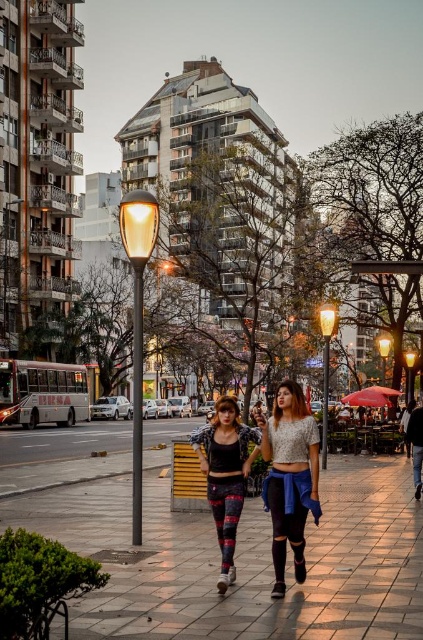
Question: Can you confirm if matte lace top at center is positioned above matte yellow glass at center?

Choices:
 (A) yes
 (B) no

Answer: (B)

Question: Is polished stone pavement at center in front of patterned leggings at center?

Choices:
 (A) yes
 (B) no

Answer: (A)

Question: Which point is farther to the camera?

Choices:
 (A) patterned leggings at center
 (B) metallic streetlight at center

Answer: (B)

Question: Can you confirm if patterned leggings at center is positioned to the left of matte glass streetlight at center?

Choices:
 (A) no
 (B) yes

Answer: (B)

Question: Which of the following is the closest to the observer?

Choices:
 (A) polished stone pavement at center
 (B) matte lace top at center
 (C) matte yellow streetlight at center
 (D) patterned leggings at center

Answer: (A)

Question: Among these objects, which one is nearest to the camera?

Choices:
 (A) polished stone pavement at center
 (B) matte glass streetlight at center
 (C) metallic streetlight at center
 (D) patterned leggings at center

Answer: (A)